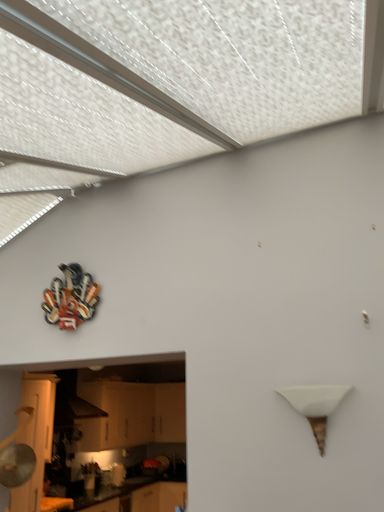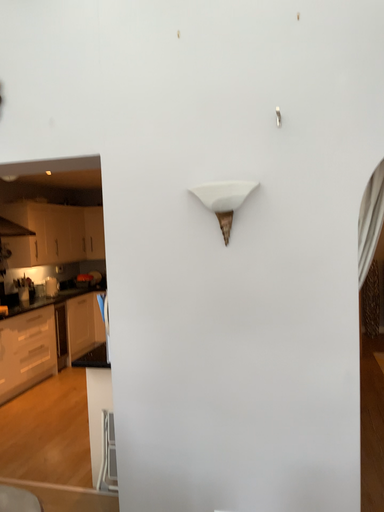
Question: Which way did the camera rotate in the video?

Choices:
 (A) rotated left
 (B) rotated right

Answer: (B)